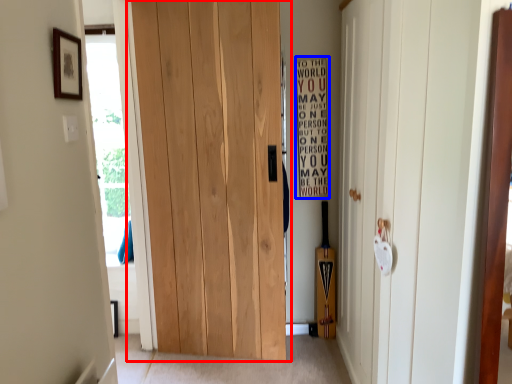
Question: Which object appears closest to the camera in this image, door (highlighted by a red box) or bulletin board (highlighted by a blue box)?

Choices:
 (A) door
 (B) bulletin board

Answer: (A)